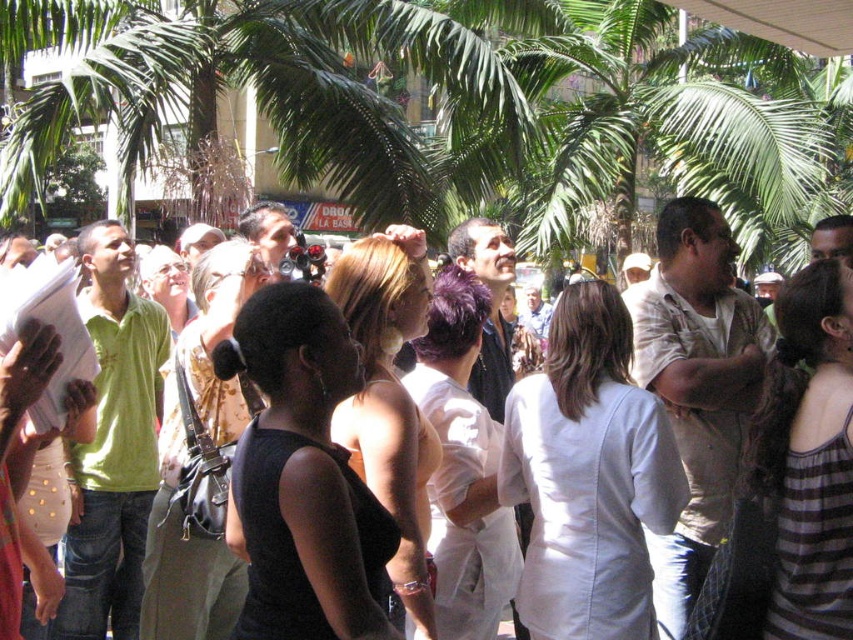
Between green leafy palm tree at center and matte black dress at center, which one has more height?

green leafy palm tree at center

At what (x,y) coordinates should I click in order to perform the action: click on green leafy palm tree at center. Please return your answer as a coordinate pair (x, y). The width and height of the screenshot is (853, 640). Looking at the image, I should click on (457, 102).

This screenshot has height=640, width=853. I want to click on green leafy palm tree at center, so click(457, 102).